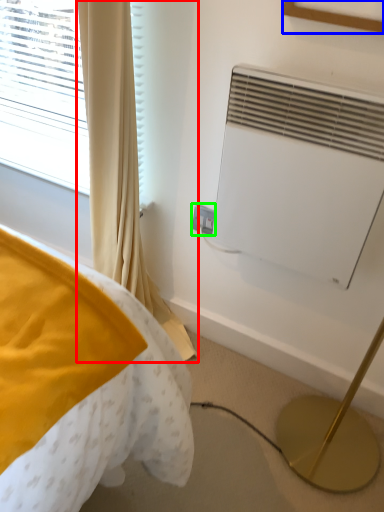
Question: Which object is the farthest from curtain (highlighted by a red box)? Choose among these: picture frame (highlighted by a blue box) or electric outlet (highlighted by a green box).

Choices:
 (A) picture frame
 (B) electric outlet

Answer: (A)